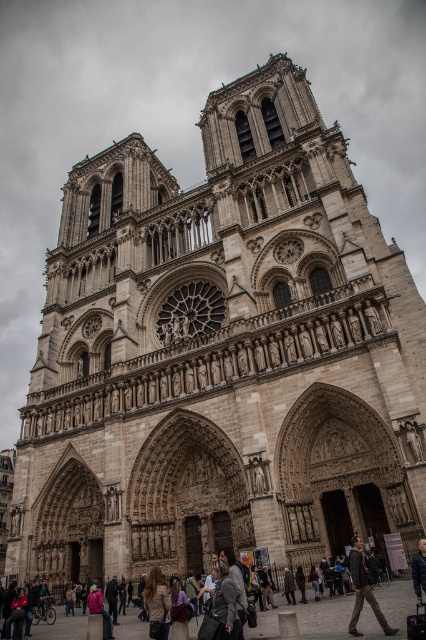
Is dark gray fabric jacket at lower right wider than dark blue leather jacket at center?

Yes, dark gray fabric jacket at lower right is wider than dark blue leather jacket at center.

Does point (374, 609) come farther from viewer compared to point (412, 564)?

No, (374, 609) is closer to viewer.

Which is behind, point (357, 582) or point (417, 598)?

Point (417, 598)

Identify the location of dark gray fabric jacket at lower right. The height and width of the screenshot is (640, 426). (363, 589).